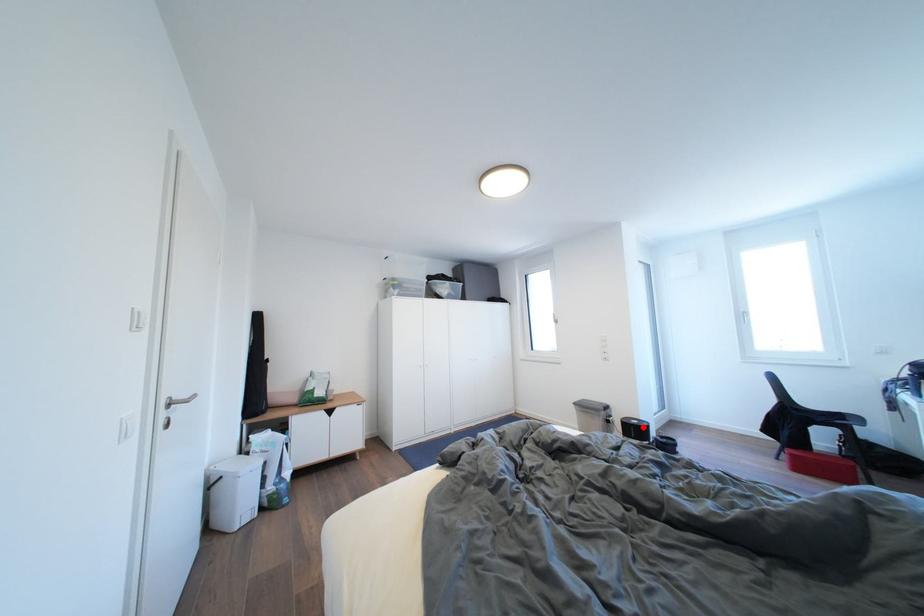
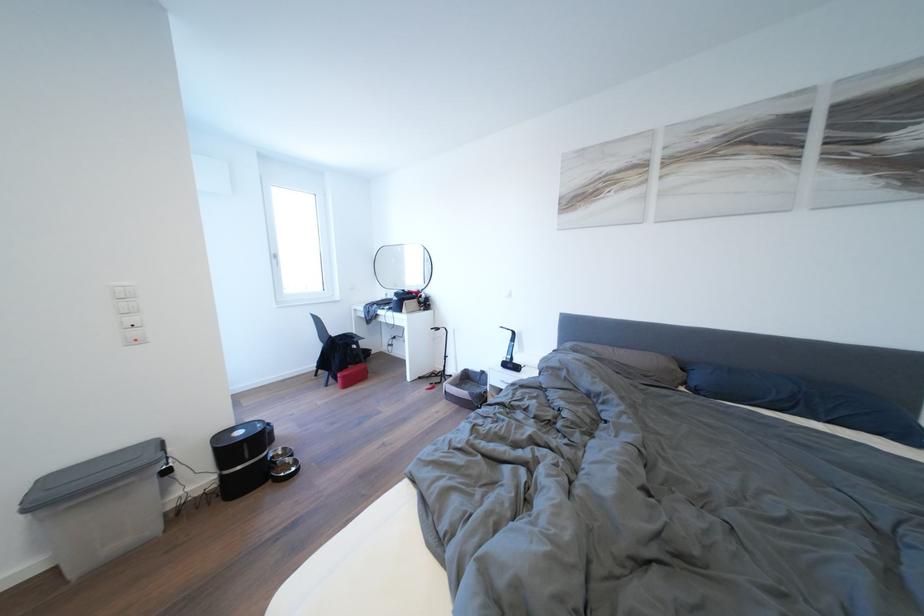
Find the pixel in the second image that matches the highlighted location in the first image.

(248, 438)